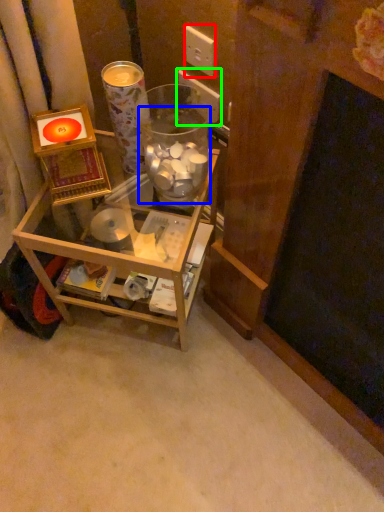
Question: Considering the real-world distances, which object is closest to electric outlet (highlighted by a red box)? glass jar (highlighted by a blue box) or electric outlet (highlighted by a green box).

Choices:
 (A) glass jar
 (B) electric outlet

Answer: (B)